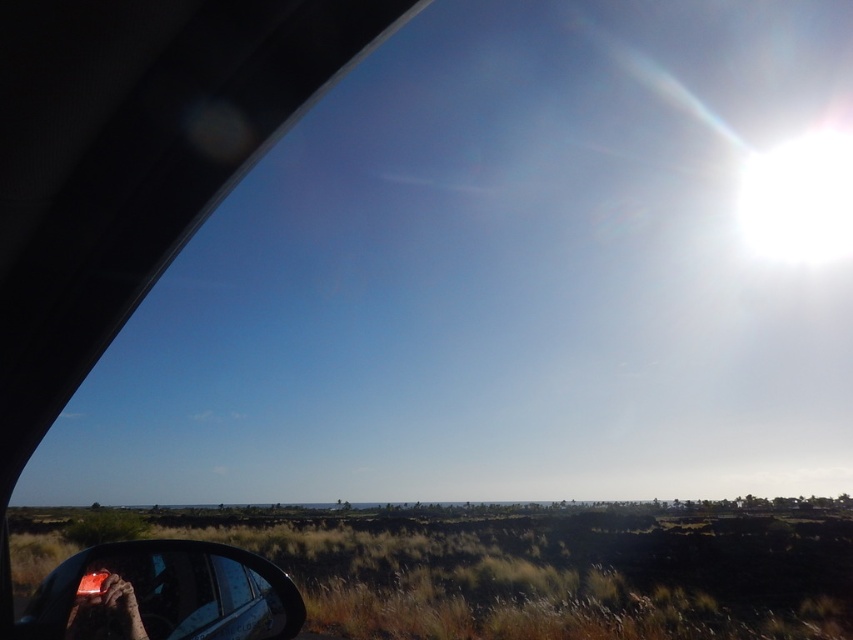
You are a passenger in a car and want to know the distance between the grassy field at lower center and the matte black rearview mirror at lower left. Can you estimate how far apart they are?

The grassy field at lower center is 19.17 meters from the matte black rearview mirror at lower left.

You are a passenger in the car and you see the grassy field at lower center and the leather glove at lower left through the window. Which object is closer to the left side of the window?

The leather glove at lower left is closer to the left side of the window because it is positioned to the left of the grassy field at lower center.